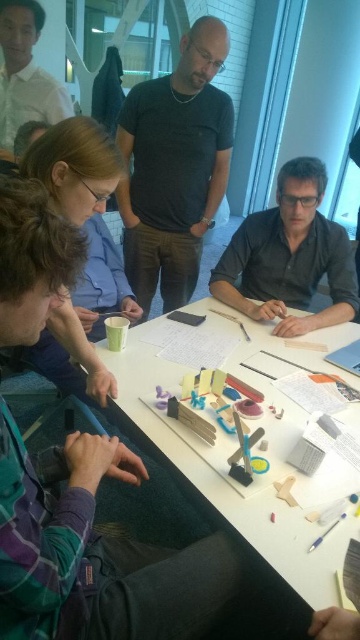
Question: Which is farther from the black matte shirt at center?

Choices:
 (A) matte black shirt at upper center
 (B) white matte table at center

Answer: (B)

Question: Can you confirm if white matte table at center is positioned above black matte shirt at center?

Choices:
 (A) yes
 (B) no

Answer: (B)

Question: Is black matte shirt at center positioned at the back of matte black shirt at upper center?

Choices:
 (A) yes
 (B) no

Answer: (B)

Question: Among these points, which one is farthest from the camera?

Choices:
 (A) (186, 120)
 (B) (295, 186)

Answer: (A)

Question: Is the position of white matte table at center less distant than that of matte black shirt at lower right?

Choices:
 (A) yes
 (B) no

Answer: (A)

Question: Which of these objects is positioned closest to the matte black shirt at lower right?

Choices:
 (A) white matte table at center
 (B) matte black shirt at upper center
 (C) black matte shirt at center

Answer: (A)